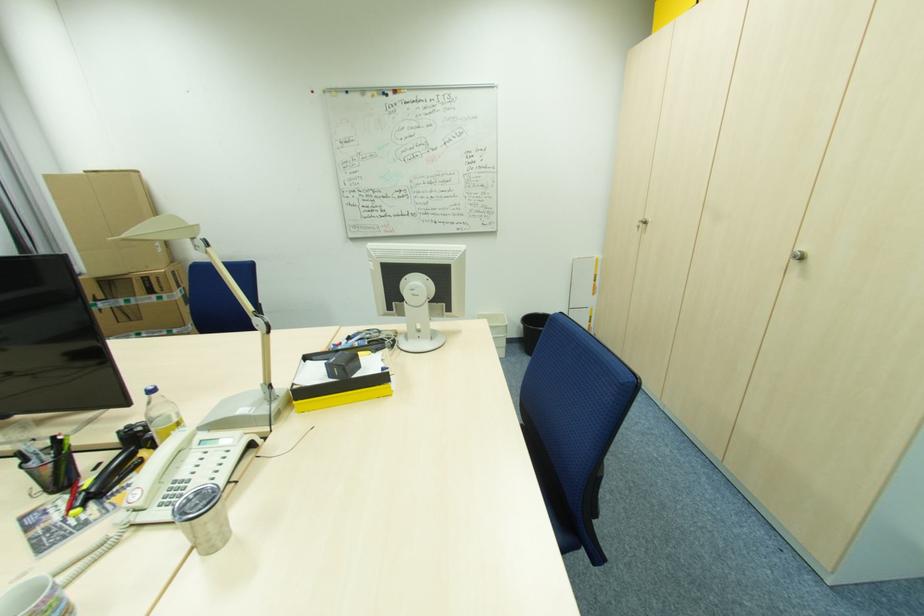
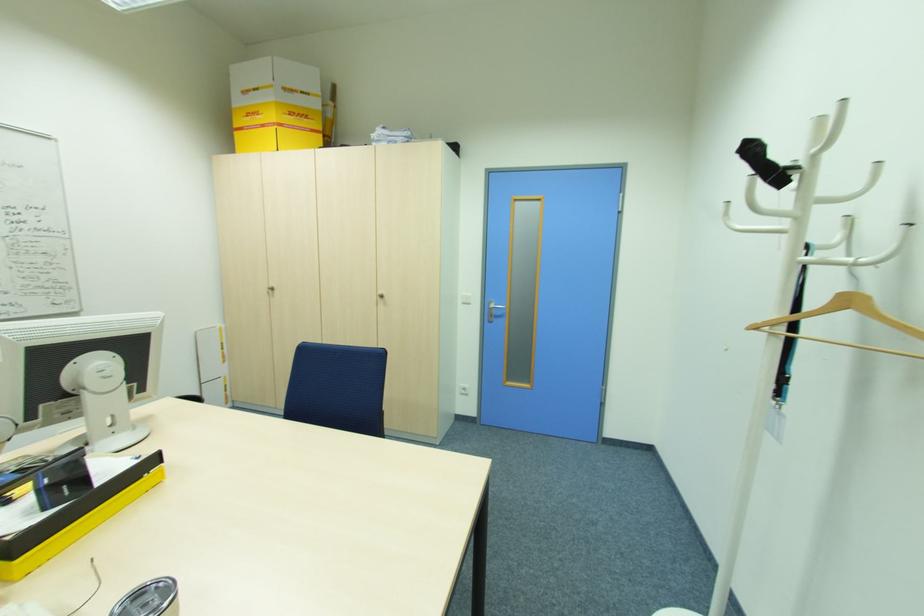
Question: The first image is from the beginning of the video and the second image is from the end. How did the camera likely rotate when shooting the video?

Choices:
 (A) Left
 (B) Right
 (C) Up
 (D) Down

Answer: (B)